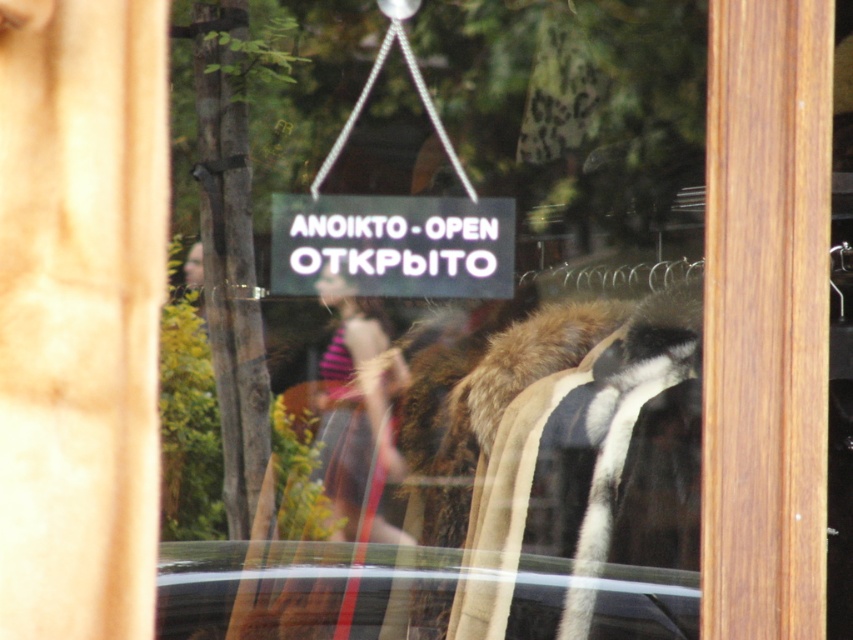
Question: Which point appears closest to the camera in this image?

Choices:
 (A) (694, 401)
 (B) (355, 474)
 (C) (506, 225)

Answer: (B)

Question: Is black plastic sign at center below striped fabric at center?

Choices:
 (A) no
 (B) yes

Answer: (A)

Question: Which is nearer to the striped fabric at center?

Choices:
 (A) fur coat at center
 (B) black plastic sign at center

Answer: (B)

Question: Can you confirm if black plastic sign at center is positioned to the right of striped fabric at center?

Choices:
 (A) no
 (B) yes

Answer: (B)

Question: Is black plastic sign at center further to camera compared to striped fabric at center?

Choices:
 (A) no
 (B) yes

Answer: (A)

Question: Which of these objects is positioned closest to the striped fabric at center?

Choices:
 (A) black plastic sign at center
 (B) fur coat at center

Answer: (A)